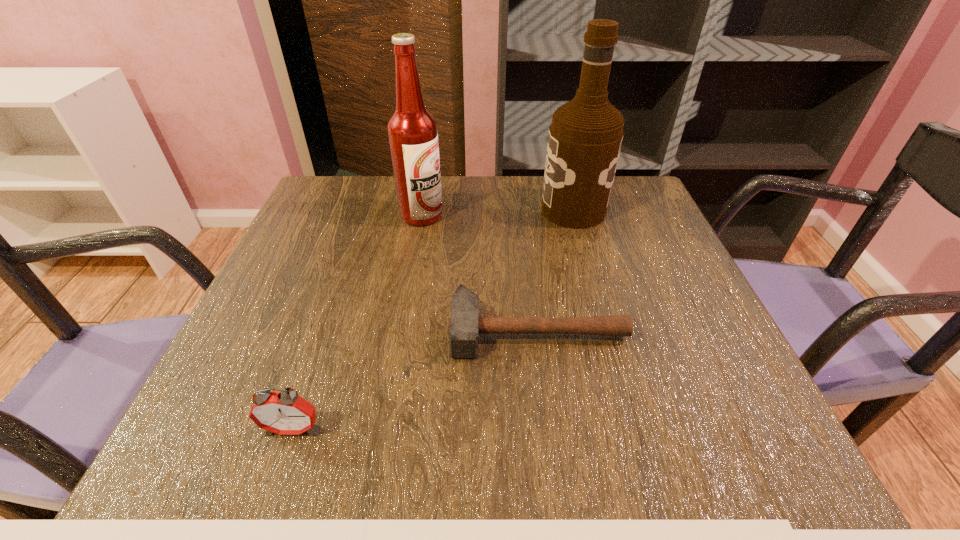
In the image, there is a desktop. Identify the location of vacant space at the far left corner. The height and width of the screenshot is (540, 960). (349, 191).

Locate an element on the screen. This screenshot has height=540, width=960. vacant space at the near left corner is located at coordinates (228, 426).

In the image, there is a desktop. In order to click on free space at the far right corner in this screenshot , I will do `click(635, 203)`.

Where is `vacant space that's between the right alcohol and the shortest object`? The width and height of the screenshot is (960, 540). vacant space that's between the right alcohol and the shortest object is located at coordinates (555, 271).

The width and height of the screenshot is (960, 540). What are the coordinates of `vacant area between the third object from right to left and the alarm clock` in the screenshot? It's located at (357, 322).

Identify the location of free area in between the third object from right to left and the hammer. The width and height of the screenshot is (960, 540). (479, 273).

Locate an element on the screen. empty space that is in between the second nearest object and the right alcohol is located at coordinates (555, 271).

Find the location of a particular element. This screenshot has height=540, width=960. unoccupied area between the second object from left to right and the leftmost object is located at coordinates (357, 322).

Identify the location of empty space between the third tallest object and the second object from left to right. point(357,322).

Find the location of a particular element. This screenshot has width=960, height=540. empty space that is in between the third object from right to left and the second nearest object is located at coordinates (479, 273).